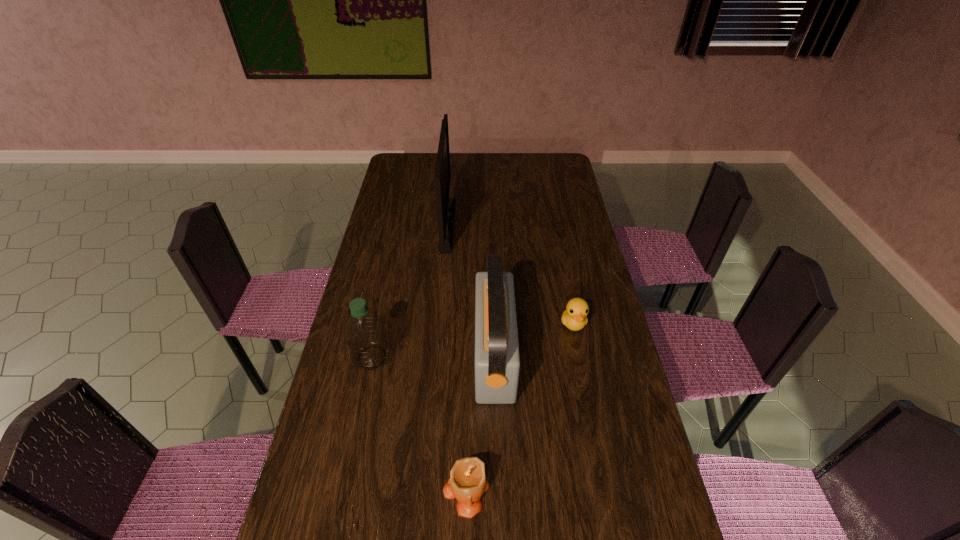
This screenshot has width=960, height=540. Find the location of `free space between the radio receiver and the monitor`. free space between the radio receiver and the monitor is located at coordinates (470, 289).

I want to click on unoccupied area between the third tallest object and the tallest object, so click(410, 291).

Identify the location of free space between the water bottle and the tallest object. The height and width of the screenshot is (540, 960). (410, 291).

This screenshot has width=960, height=540. What are the coordinates of `vacant space that's between the radio receiver and the fourth object from right to left` in the screenshot? It's located at (470, 289).

The height and width of the screenshot is (540, 960). Identify the location of free spot between the leftmost object and the radio receiver. (433, 356).

In order to click on vacant region between the candle and the radio receiver in this screenshot , I will do `click(480, 422)`.

This screenshot has height=540, width=960. Identify the location of empty location between the radio receiver and the rightmost object. (534, 339).

Identify the location of free area in between the nearest object and the rightmost object. (519, 407).

At what (x,y) coordinates should I click in order to perform the action: click on vacant space that's between the nearest object and the third tallest object. Please return your answer as a coordinate pair (x, y). The width and height of the screenshot is (960, 540). Looking at the image, I should click on (420, 423).

What are the coordinates of `object that is the third nearest to the leftmost object` in the screenshot? It's located at (445, 206).